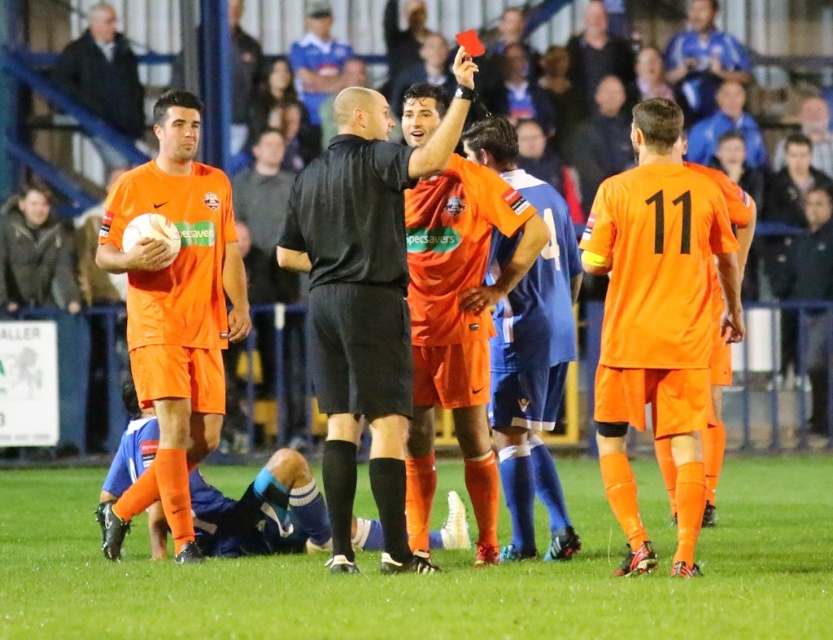
You are a photographer standing at the edge of the soccer field. You want to take a photo of the orange matte uniform at center and the black matte referee at center. Which one of them appears larger in the photo?

The black matte referee at center appears larger in the photo because the orange matte uniform at center is smaller than the black matte referee at center.

You are a soccer ball placed on the orange synthetic turf at center. If you roll towards the orange matte uniform at center, will you move to the left or right side of the uniform?

The orange synthetic turf at center is wider than the orange matte uniform at center, so the soccer ball will move to the right side of the orange matte uniform at center.

You are a photographer at the soccer match. You want to take a photo that includes both the black matte referee at center and the matte orange soccer uniform at left. Which object should be placed closer to the camera to ensure both are in focus?

The black matte referee at center is shorter than the matte orange soccer uniform at left, so to ensure both are in focus, the referee should be closer to the camera.